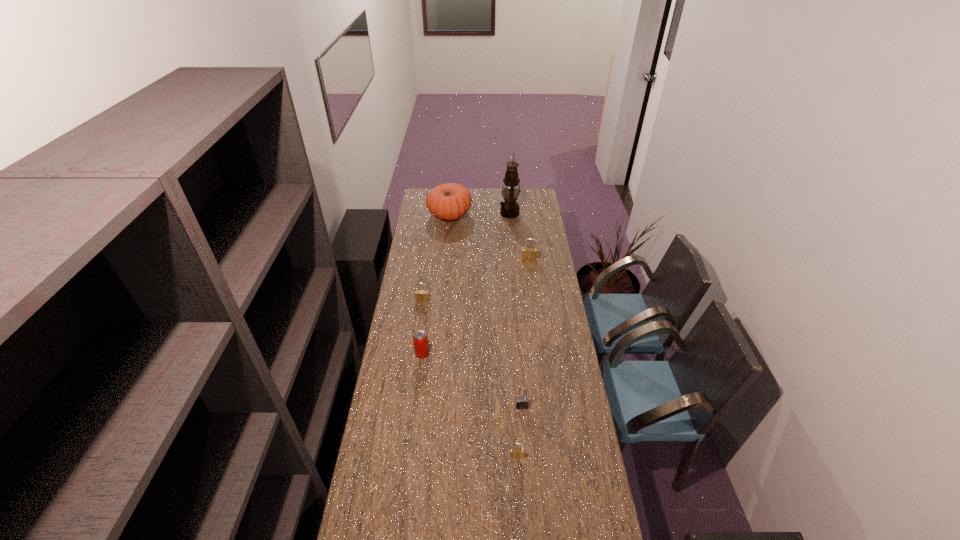
Locate an element on the screen. This screenshot has height=540, width=960. vacant space at the far edge of the desktop is located at coordinates (497, 206).

Where is `free space at the left edge`? This screenshot has height=540, width=960. free space at the left edge is located at coordinates (402, 303).

The image size is (960, 540). Find the location of `vacant space at the right edge`. vacant space at the right edge is located at coordinates (541, 254).

At what (x,y) coordinates should I click in order to perform the action: click on empty space between the pumpkin and the pink beer can. Please return your answer as a coordinate pair (x, y). The width and height of the screenshot is (960, 540). Looking at the image, I should click on (436, 284).

What are the coordinates of `vacant area that lies between the farthest padlock and the right gray padlock` in the screenshot? It's located at (525, 333).

Where is `vacant area between the fourth nearest object and the oil lamp`? The height and width of the screenshot is (540, 960). vacant area between the fourth nearest object and the oil lamp is located at coordinates tap(466, 284).

Identify the location of unoccupied area between the pumpkin and the farther gray padlock. This screenshot has width=960, height=540. (486, 310).

Locate an element on the screen. This screenshot has height=540, width=960. vacant space in between the sixth shortest object and the brown oil lamp is located at coordinates (519, 237).

You are a GUI agent. You are given a task and a screenshot of the screen. Output one action in this format:
    pyautogui.click(x=<x>, y=<y>)
    Task: Click on the vacant area that lies between the seventh shortest object and the sixth farthest object
    This screenshot has height=540, width=960.
    Given the screenshot: What is the action you would take?
    pyautogui.click(x=486, y=310)

Select which object appears as the fourth closest to the third tallest object. Please provide its 2D coordinates. Your answer should be formatted as a tuple, i.e. [(x, y)], where the tuple contains the x and y coordinates of a point satisfying the conditions above.

[(421, 347)]